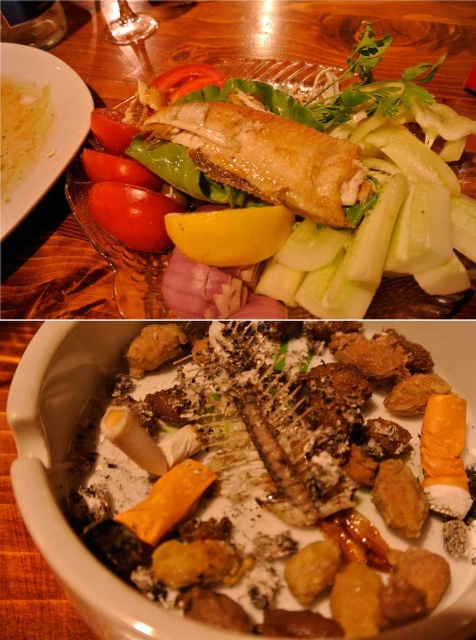
You are a food critic who wants to describe the visual presentation of the dish. Which of the two central items, the crumbly golden bread at center or the golden crispy fish at center, has a larger width?

The golden crispy fish at center has a larger width than the crumbly golden bread at center.

You are a food critic evaluating the dish. You notice the crumbly golden bread at center and the matte brown plate at upper left. Which object is taller?

The crumbly golden bread at center is not as tall as the matte brown plate at upper left, so the matte brown plate at upper left is taller.

You are a food stylist arranging a photo shoot. You have a crumbly golden bread at center and a matte brown plate at upper left. Which object takes up more area on the plate?

The matte brown plate at upper left takes up more area than the crumbly golden bread at center.